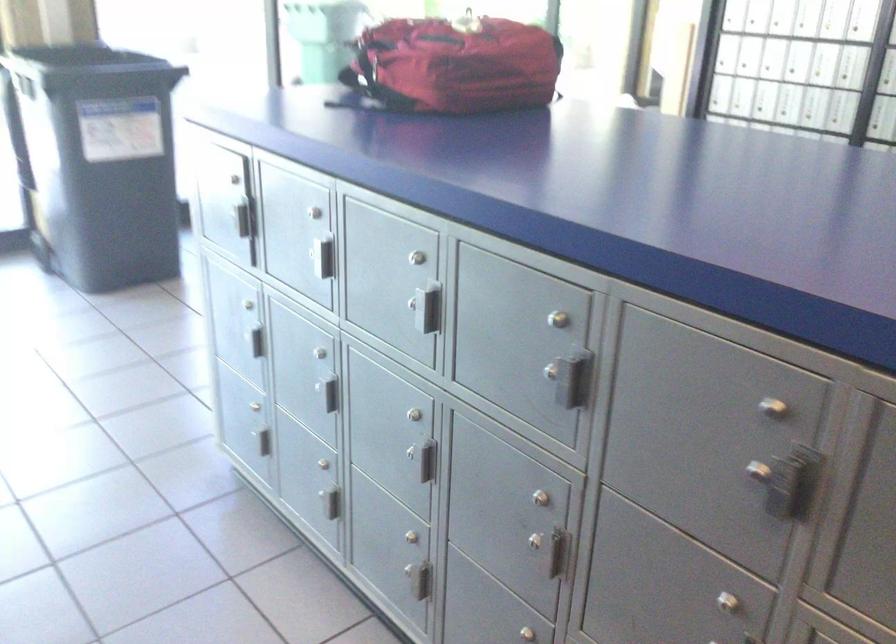
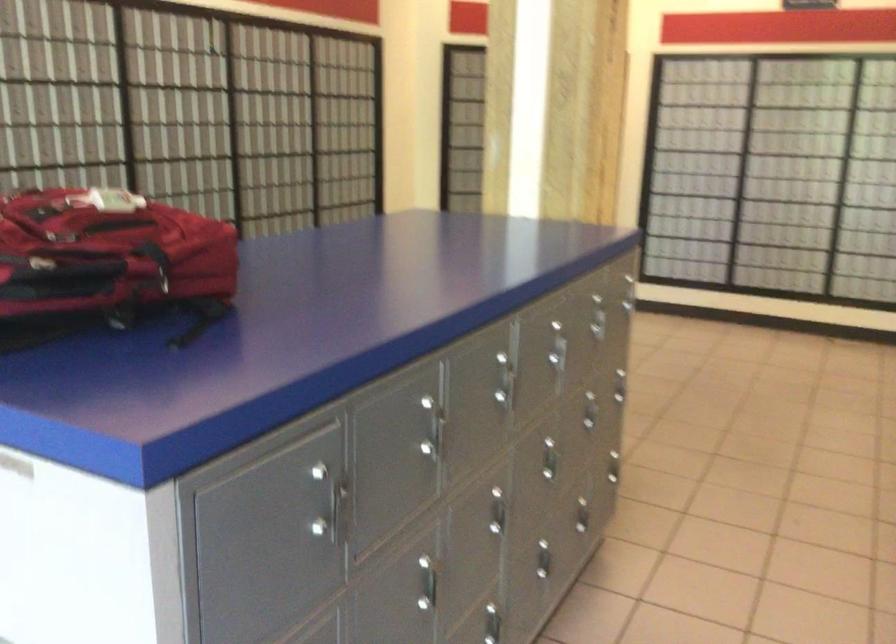
In the second image, find the point that corresponds to (426,292) in the first image.

(503, 381)